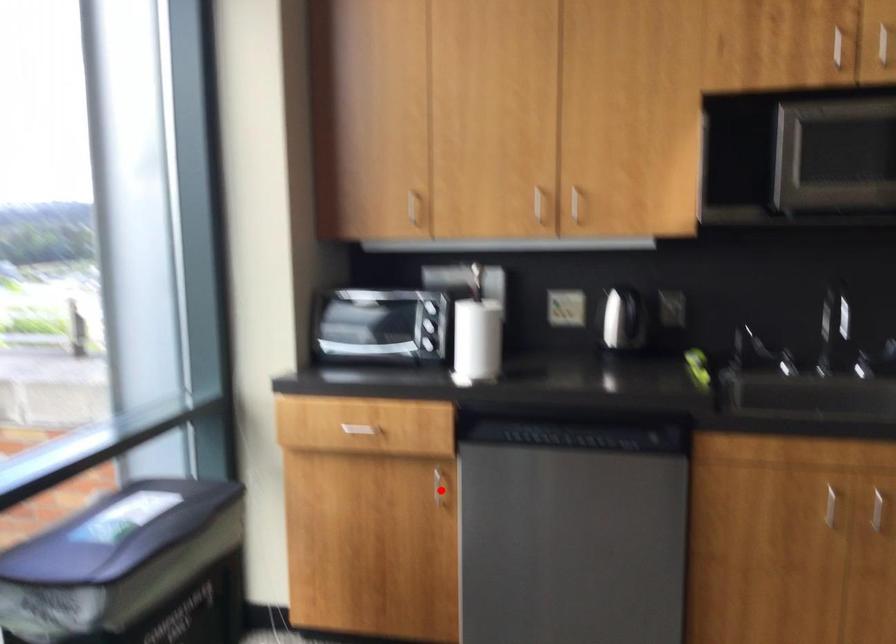
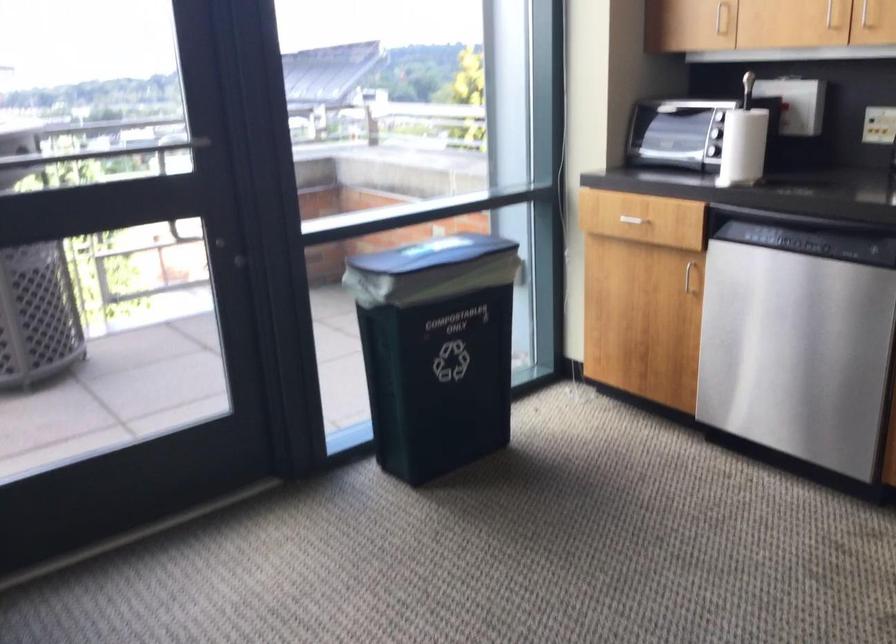
Question: I am providing you with two images of the same scene from different viewpoints. In image1, a red point is highlighted. Considering the same 3D point in image2, which of the following is correct?

Choices:
 (A) It is closer
 (B) It is farther

Answer: (B)